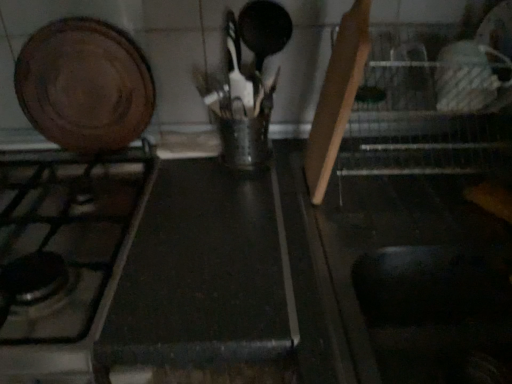
Question: From a real-world perspective, does wooden cutting board at upper left sit lower than matte black gas stove at left?

Choices:
 (A) yes
 (B) no

Answer: (B)

Question: Is wooden cutting board at upper left turned away from matte black gas stove at left?

Choices:
 (A) no
 (B) yes

Answer: (A)

Question: Is wooden cutting board at upper left outside matte black gas stove at left?

Choices:
 (A) yes
 (B) no

Answer: (A)

Question: From the image's perspective, does wooden cutting board at upper left appear lower than matte black gas stove at left?

Choices:
 (A) yes
 (B) no

Answer: (B)

Question: Is the position of wooden cutting board at upper left less distant than that of matte black gas stove at left?

Choices:
 (A) yes
 (B) no

Answer: (B)

Question: Does wooden cutting board at upper left have a greater width compared to matte black gas stove at left?

Choices:
 (A) yes
 (B) no

Answer: (B)

Question: Is matte black gas stove at left beside wooden cutting board at upper left?

Choices:
 (A) no
 (B) yes

Answer: (A)

Question: From the image's perspective, is matte black gas stove at left on wooden cutting board at upper left?

Choices:
 (A) yes
 (B) no

Answer: (B)

Question: Is matte black gas stove at left at the right side of wooden cutting board at upper left?

Choices:
 (A) no
 (B) yes

Answer: (A)

Question: Is matte black gas stove at left bigger than wooden cutting board at upper left?

Choices:
 (A) no
 (B) yes

Answer: (B)

Question: Does matte black gas stove at left lie in front of wooden cutting board at upper left?

Choices:
 (A) yes
 (B) no

Answer: (A)

Question: From a real-world perspective, is matte black gas stove at left physically above wooden cutting board at upper left?

Choices:
 (A) yes
 (B) no

Answer: (B)

Question: From the image's perspective, would you say black matte counter top at center is shown under wooden cutting board at upper left?

Choices:
 (A) no
 (B) yes

Answer: (B)